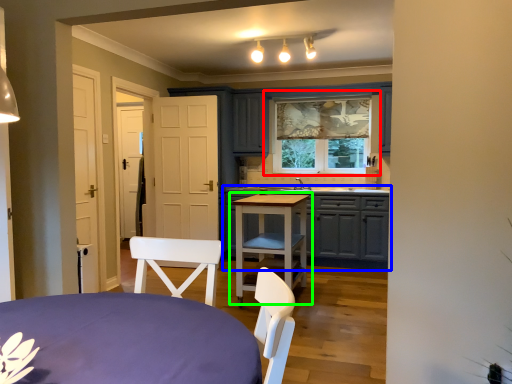
Question: Considering the real-world distances, which object is closest to window (highlighted by a red box)? cabinetry (highlighted by a blue box) or table (highlighted by a green box).

Choices:
 (A) cabinetry
 (B) table

Answer: (A)